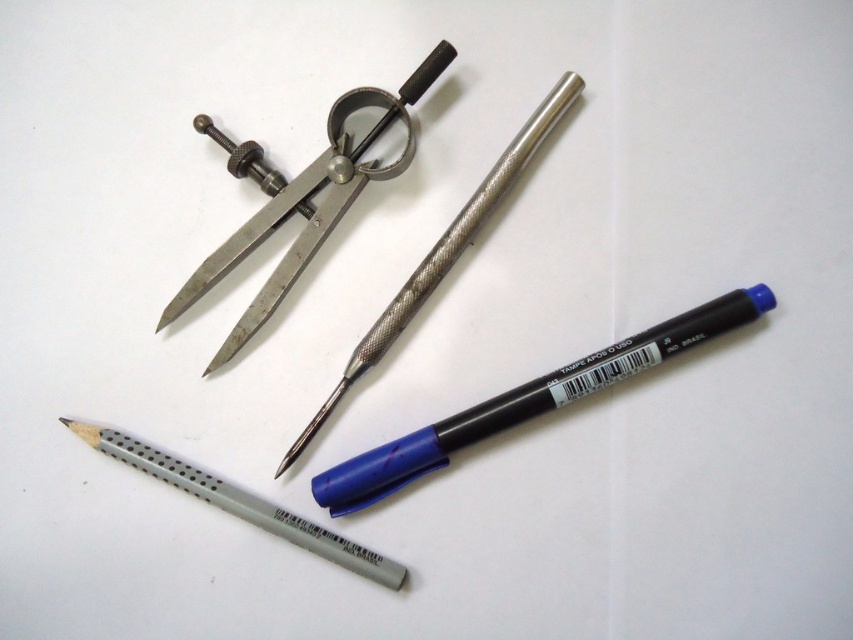
At what (x,y) coordinates should I click in order to perform the action: click on blue plastic pen at lower right. Please return your answer as a coordinate pair (x, y). The height and width of the screenshot is (640, 853). Looking at the image, I should click on (527, 401).

Which is more to the left, blue plastic pen at lower right or metallic textured pencil at center?

Positioned to the left is metallic textured pencil at center.

Identify the location of blue plastic pen at lower right. (527, 401).

At what (x,y) coordinates should I click in order to perform the action: click on blue plastic pen at lower right. Please return your answer as a coordinate pair (x, y). This screenshot has height=640, width=853. Looking at the image, I should click on (527, 401).

Between metallic textured pencil at center and gray matte pencil at lower center, which one has less height?

gray matte pencil at lower center

Is point (329, 406) positioned after point (134, 451)?

Yes, it is.

Where is `metallic textured pencil at center`? The height and width of the screenshot is (640, 853). metallic textured pencil at center is located at coordinates (444, 252).

Between point (296, 256) and point (445, 236), which one is positioned behind?

The point (296, 256) is more distant.

Can you confirm if metallic/textured scissors at upper center is wider than metallic textured pencil at center?

No.

Between point (221, 273) and point (485, 218), which one is positioned in front?

Point (221, 273) is in front.

At what (x,y) coordinates should I click in order to perform the action: click on metallic/textured scissors at upper center. Please return your answer as a coordinate pair (x, y). This screenshot has width=853, height=640. Looking at the image, I should click on (309, 202).